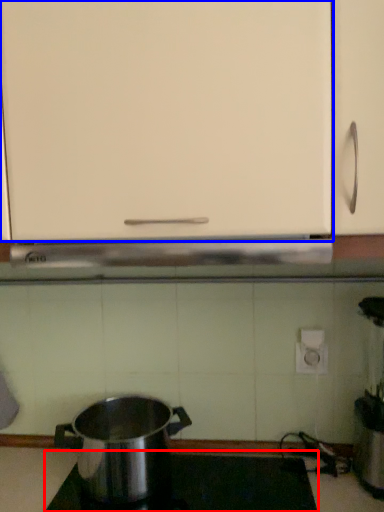
Question: Which object appears closest to the camera in this image, gas stove (highlighted by a red box) or cabinetry (highlighted by a blue box)?

Choices:
 (A) gas stove
 (B) cabinetry

Answer: (B)